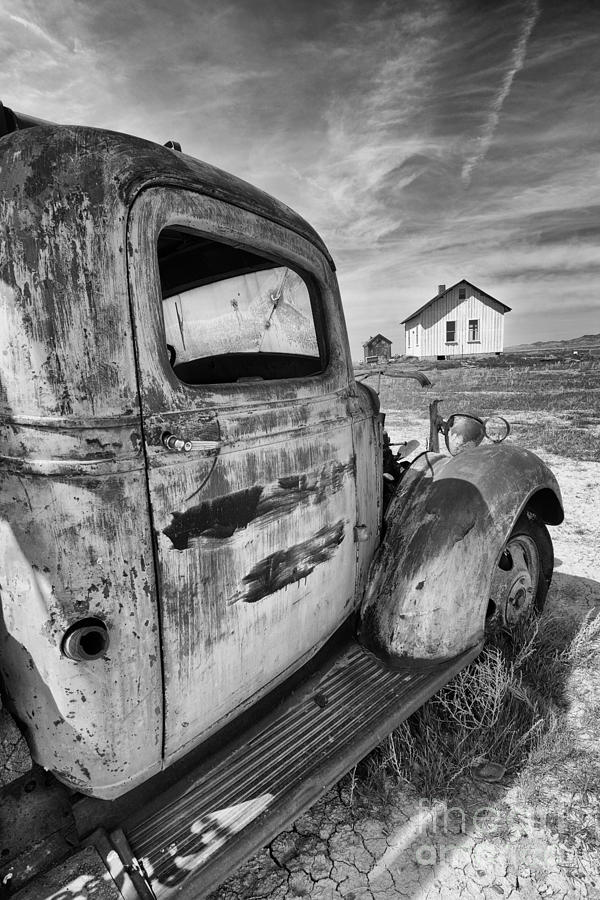
Find the location of `door handle`. door handle is located at coordinates (194, 451).